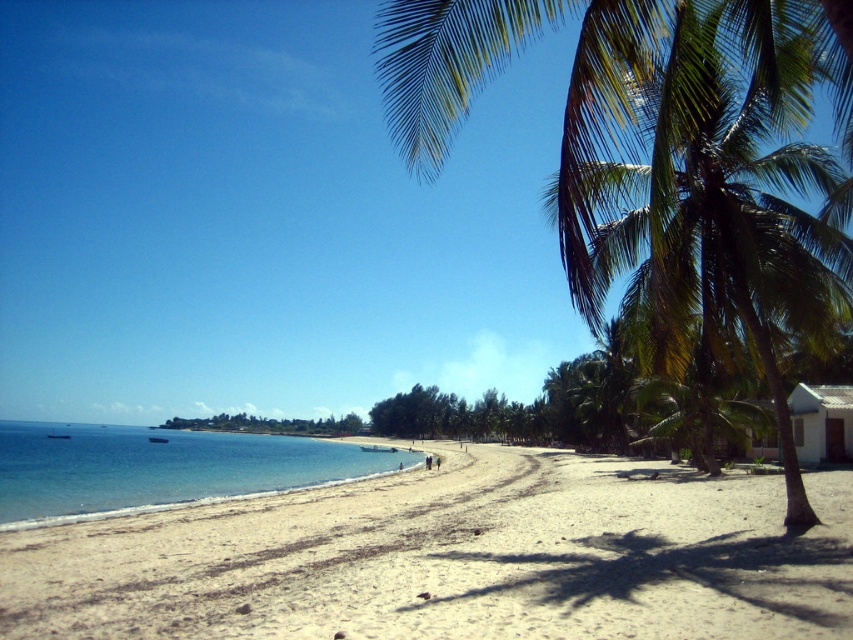
Looking at this image, does white sandy beach at lower left have a lesser height compared to clear blue water at lower left?

Yes.

Does white sandy beach at lower left appear on the right side of clear blue water at lower left?

Yes, white sandy beach at lower left is to the right of clear blue water at lower left.

Find the location of a particular element. white sandy beach at lower left is located at coordinates (451, 557).

Identify the location of white sandy beach at lower left. (451, 557).

Does white sandy beach at lower left appear over green leafy palm tree at right?

No, white sandy beach at lower left is not above green leafy palm tree at right.

Which is more to the left, white sandy beach at lower left or green leafy palm tree at right?

white sandy beach at lower left is more to the left.

Which is in front, point (570, 499) or point (613, 93)?

Point (613, 93)

The image size is (853, 640). I want to click on white sandy beach at lower left, so click(451, 557).

Measure the distance between white sandy beach at lower left and camera.

white sandy beach at lower left and camera are 6.67 meters apart from each other.

The image size is (853, 640). I want to click on white sandy beach at lower left, so click(451, 557).

Find the location of a particular element. The width and height of the screenshot is (853, 640). white sandy beach at lower left is located at coordinates (451, 557).